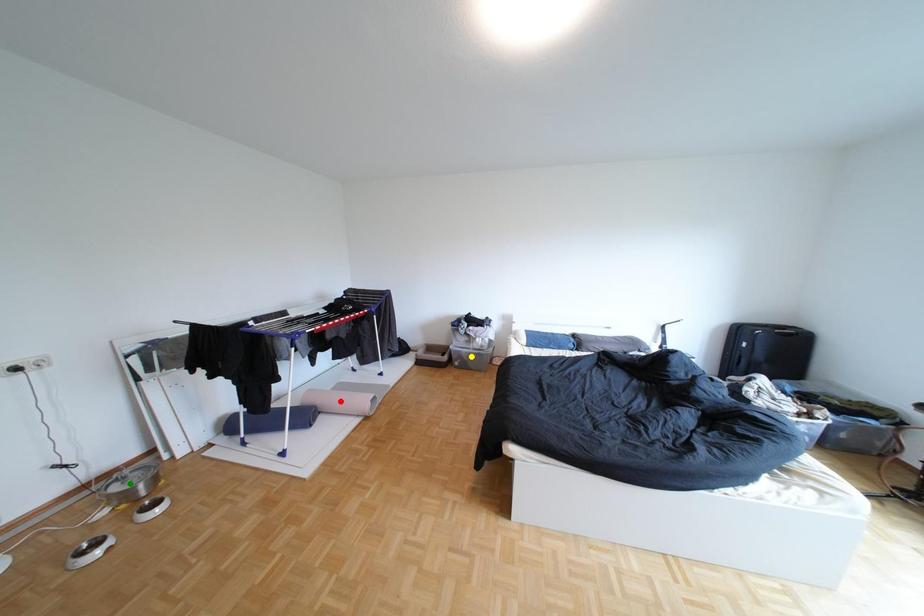
Order these from nearest to farthest:
yellow point
green point
red point

1. green point
2. red point
3. yellow point